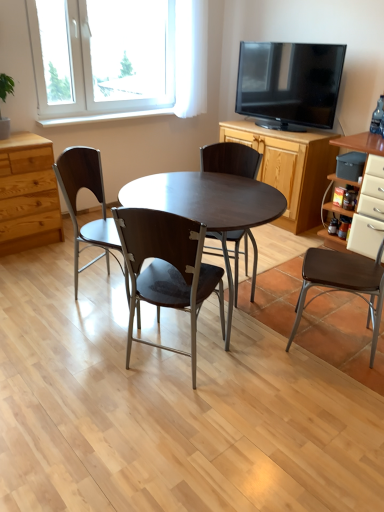
How much space does wooden cabinet at center right, which appears as the first cabinetry when viewed from the left, occupy horizontally?

wooden cabinet at center right, which appears as the first cabinetry when viewed from the left, is 56.64 centimeters wide.

This screenshot has width=384, height=512. In order to click on dark brown wood chair at center, the second chair positioned from the right in this screenshot , I will do `click(230, 159)`.

What do you see at coordinates (97, 199) in the screenshot? I see `matte brown chair at left, which is the first chair from left to right` at bounding box center [97, 199].

You are a GUI agent. You are given a task and a screenshot of the screen. Output one action in this format:
    pyautogui.click(x=<x>, y=<y>)
    Task: Click on the transparent glass window at upper left
    The width and height of the screenshot is (384, 512).
    Given the screenshot: What is the action you would take?
    pyautogui.click(x=118, y=58)

Measure the distance between point (241, 50) and camera.

Point (241, 50) and camera are 3.85 meters apart.

You are a GUI agent. You are given a task and a screenshot of the screen. Output one action in this format:
    pyautogui.click(x=<x>, y=<y>)
    Task: Click on the black glossy tv at upper right
    The image size is (384, 512).
    Given the screenshot: What is the action you would take?
    pyautogui.click(x=289, y=84)

The height and width of the screenshot is (512, 384). Find the location of `matte brown chair at center, which is counted as the third chair, starting from the right`. matte brown chair at center, which is counted as the third chair, starting from the right is located at coordinates (167, 268).

The image size is (384, 512). Identify the location of wooden cabinet at center right, marked as the 2th cabinetry in a right-to-left arrangement. (290, 168).

From a real-world perspective, is wooden cabinet at center right, marked as the 2th cabinetry in a right-to-left arrangement, on top of light brown wood chest of drawers at left?

Indeed, from a real-world perspective, wooden cabinet at center right, marked as the 2th cabinetry in a right-to-left arrangement, stands above light brown wood chest of drawers at left.

Would you say wooden cabinet at center right, which appears as the first cabinetry when viewed from the left, is inside or outside light brown wood chest of drawers at left?

wooden cabinet at center right, which appears as the first cabinetry when viewed from the left, is not inside light brown wood chest of drawers at left, it's outside.

Is wooden cabinet at center right, which appears as the first cabinetry when viewed from the left, oriented towards light brown wood chest of drawers at left?

Yes, wooden cabinet at center right, which appears as the first cabinetry when viewed from the left, faces towards light brown wood chest of drawers at left.

Which is more to the left, wooden cabinet at center right, marked as the 2th cabinetry in a right-to-left arrangement, or light brown wood chest of drawers at left?

Positioned to the left is light brown wood chest of drawers at left.

Considering the positions of objects wooden cabinet at center right, which appears as the first cabinetry when viewed from the left, and transparent glass window at upper left in the image provided, who is more to the right, wooden cabinet at center right, which appears as the first cabinetry when viewed from the left, or transparent glass window at upper left?

wooden cabinet at center right, which appears as the first cabinetry when viewed from the left.

Could you tell me if wooden cabinet at center right, marked as the 2th cabinetry in a right-to-left arrangement, is turned towards transparent glass window at upper left?

No, wooden cabinet at center right, marked as the 2th cabinetry in a right-to-left arrangement, does not turn towards transparent glass window at upper left.

Can you tell me how much wooden cabinet at center right, marked as the 2th cabinetry in a right-to-left arrangement, and transparent glass window at upper left differ in facing direction?

The angular difference between wooden cabinet at center right, marked as the 2th cabinetry in a right-to-left arrangement, and transparent glass window at upper left is 89.3 degrees.

From the image's perspective, which is above, wooden cabinet at center right, marked as the 2th cabinetry in a right-to-left arrangement, or transparent glass window at upper left?

From the image's view, transparent glass window at upper left is above.

Looking at their sizes, would you say white glossy cabinet at right, marked as the second cabinetry in a left-to-right arrangement, is wider or thinner than dark brown wood chair at center, the second chair positioned from the right?

Considering their sizes, white glossy cabinet at right, marked as the second cabinetry in a left-to-right arrangement, looks broader than dark brown wood chair at center, the second chair positioned from the right.

Does white glossy cabinet at right, positioned as the first cabinetry in right-to-left order, contain dark brown wood chair at center, which is the 3th chair in left-to-right order?

No, dark brown wood chair at center, which is the 3th chair in left-to-right order, is not inside white glossy cabinet at right, positioned as the first cabinetry in right-to-left order.

Which object is closer to the camera taking this photo, white glossy cabinet at right, marked as the second cabinetry in a left-to-right arrangement, or dark brown wood chair at center, which is the 3th chair in left-to-right order?

dark brown wood chair at center, which is the 3th chair in left-to-right order, is closer to the camera.

Which is in front, point (380, 139) or point (242, 172)?

Point (242, 172)

Is point (362, 133) farther from camera compared to point (75, 177)?

Yes, point (362, 133) is behind point (75, 177).

From the image's perspective, would you say white glossy cabinet at right, positioned as the first cabinetry in right-to-left order, is shown under matte brown chair at left, acting as the 4th chair starting from the right?

No, from the image's perspective, white glossy cabinet at right, positioned as the first cabinetry in right-to-left order, is not beneath matte brown chair at left, acting as the 4th chair starting from the right.

Which object is wider, white glossy cabinet at right, marked as the second cabinetry in a left-to-right arrangement, or matte brown chair at left, which is the first chair from left to right?

Wider between the two is white glossy cabinet at right, marked as the second cabinetry in a left-to-right arrangement.

In the image, is white glossy cabinet at right, positioned as the first cabinetry in right-to-left order, positioned in front of or behind matte brown chair at left, which is the first chair from left to right?

Visually, white glossy cabinet at right, positioned as the first cabinetry in right-to-left order, is located behind matte brown chair at left, which is the first chair from left to right.

Is black glossy tv at upper right looking in the opposite direction of light brown wood chest of drawers at left?

black glossy tv at upper right does not have its back to light brown wood chest of drawers at left.

Does black glossy tv at upper right touch light brown wood chest of drawers at left?

There is a gap between black glossy tv at upper right and light brown wood chest of drawers at left.

From a real-world perspective, is black glossy tv at upper right above or below light brown wood chest of drawers at left?

black glossy tv at upper right is above light brown wood chest of drawers at left.

Is point (345, 46) less distant than point (19, 194)?

No.

Which is behind, point (276, 76) or point (330, 256)?

The point (276, 76) is farther from the camera.

From a real-world perspective, is black glossy tv at upper right positioned over brown leather chair at right, the first chair from the right, based on gravity?

Yes, from a real-world perspective, black glossy tv at upper right is above brown leather chair at right, the first chair from the right.

How many degrees apart are the facing directions of black glossy tv at upper right and brown leather chair at right, the first chair from the right?

59.7 degrees separate the facing orientations of black glossy tv at upper right and brown leather chair at right, the first chair from the right.

Is black glossy tv at upper right smaller than brown leather chair at right, the first chair from the right?

Actually, black glossy tv at upper right might be larger than brown leather chair at right, the first chair from the right.

Are transparent glass window at upper left and light brown wood chest of drawers at left making contact?

No, transparent glass window at upper left is not with light brown wood chest of drawers at left.

From a real-world perspective, which object rests below the other?

light brown wood chest of drawers at left, from a real-world perspective.

Can you confirm if transparent glass window at upper left is taller than light brown wood chest of drawers at left?

Yes.

Looking at this image, in terms of width, does transparent glass window at upper left look wider or thinner when compared to light brown wood chest of drawers at left?

transparent glass window at upper left is thinner than light brown wood chest of drawers at left.

Where is `cabinetry that is the 1st object to the right of the light brown wood chest of drawers at left, starting at the anchor`? This screenshot has height=512, width=384. cabinetry that is the 1st object to the right of the light brown wood chest of drawers at left, starting at the anchor is located at coordinates (290, 168).

Find the location of a particular element. Image resolution: width=384 pixels, height=512 pixels. window that appears on the left of wooden cabinet at center right, which appears as the first cabinetry when viewed from the left is located at coordinates (118, 58).

From the image, which object appears to be farther from light brown wood chest of drawers at left, transparent glass window at upper left or white glossy cabinet at right, positioned as the first cabinetry in right-to-left order?

white glossy cabinet at right, positioned as the first cabinetry in right-to-left order, is positioned further to the anchor light brown wood chest of drawers at left.

Based on the photo, from the image, which object appears to be farther from wooden cabinet at center right, marked as the 2th cabinetry in a right-to-left arrangement, transparent glass window at upper left or matte dark wood table at center?

matte dark wood table at center is further to wooden cabinet at center right, marked as the 2th cabinetry in a right-to-left arrangement.

In the scene shown: Which object lies further to the anchor point light brown wood chest of drawers at left, wooden cabinet at center right, which appears as the first cabinetry when viewed from the left, or brown leather chair at right, the fourth chair from the left?

brown leather chair at right, the fourth chair from the left, is positioned further to the anchor light brown wood chest of drawers at left.

Looking at the image, which one is located further to brown leather chair at right, the fourth chair from the left, light brown wood chest of drawers at left or transparent glass window at upper left?

transparent glass window at upper left.

Considering their positions, is black glossy tv at upper right positioned further to brown leather chair at right, the fourth chair from the left, than matte dark wood table at center?

black glossy tv at upper right.

Estimate the real-world distances between objects in this image. Which object is closer to black glossy tv at upper right, matte brown chair at left, acting as the 4th chair starting from the right, or brown leather chair at right, the first chair from the right?

The object closer to black glossy tv at upper right is brown leather chair at right, the first chair from the right.

Estimate the real-world distances between objects in this image. Which object is further from dark brown wood chair at center, the second chair positioned from the right, black glossy tv at upper right or transparent glass window at upper left?

transparent glass window at upper left is positioned further to the anchor dark brown wood chair at center, the second chair positioned from the right.

Based on the photo, from the image, which object appears to be nearer to matte brown chair at center, marked as the 2th chair in a left-to-right arrangement, dark brown wood chair at center, the second chair positioned from the right, or transparent glass window at upper left?

dark brown wood chair at center, the second chair positioned from the right, is positioned closer to the anchor matte brown chair at center, marked as the 2th chair in a left-to-right arrangement.

Locate an element on the screen. desk between matte brown chair at left, acting as the 4th chair starting from the right, and dark brown wood chair at center, which is the 3th chair in left-to-right order, in the horizontal direction is located at coordinates (209, 206).

The width and height of the screenshot is (384, 512). Identify the location of television between brown leather chair at right, the first chair from the right, and wooden cabinet at center right, marked as the 2th cabinetry in a right-to-left arrangement, from front to back. (289, 84).

Locate an element on the screen. This screenshot has height=512, width=384. desk between transparent glass window at upper left and brown leather chair at right, the fourth chair from the left, in the up-down direction is located at coordinates (209, 206).

At what (x,y) coordinates should I click in order to perform the action: click on desk located between matte brown chair at left, acting as the 4th chair starting from the right, and brown leather chair at right, the fourth chair from the left, in the left-right direction. Please return your answer as a coordinate pair (x, y). Looking at the image, I should click on (209, 206).